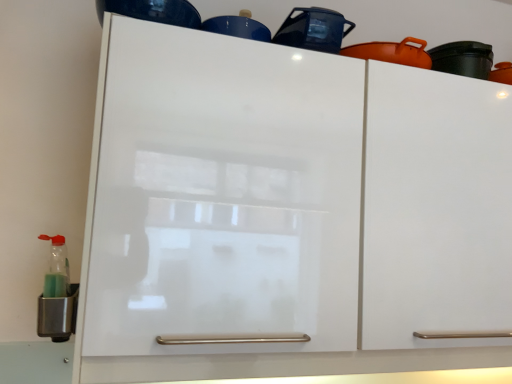
In order to face glossy ceramic pot at upper center, which ranks as the 2th appliance in bottom-to-top order, should I rotate leftwards or rightwards?

Turn right by 8.544 degrees to look at glossy ceramic pot at upper center, which ranks as the 2th appliance in bottom-to-top order.

What do you see at coordinates (58, 315) in the screenshot? I see `metallic green bottle at lower left, placed as the 1th appliance when sorted from bottom to top` at bounding box center [58, 315].

The image size is (512, 384). Find the location of `glossy blue cup at upper center, acting as the first appliance starting from the top`. glossy blue cup at upper center, acting as the first appliance starting from the top is located at coordinates (238, 26).

From the image's perspective, which object appears higher, glossy ceramic pot at upper center, the 3th appliance in the left-to-right sequence, or glossy blue cup at upper center, the third appliance in the bottom-to-top sequence?

glossy blue cup at upper center, the third appliance in the bottom-to-top sequence, appears higher in the image.

The width and height of the screenshot is (512, 384). In order to click on appliance that is above the glossy blue cup at upper center, acting as the first appliance starting from the top (from a real-world perspective) in this screenshot , I will do `click(314, 29)`.

From a real-world perspective, does glossy ceramic pot at upper center, the 3th appliance in the left-to-right sequence, sit lower than glossy blue cup at upper center, acting as the first appliance starting from the top?

Incorrect, from a real-world perspective, glossy ceramic pot at upper center, the 3th appliance in the left-to-right sequence, is higher than glossy blue cup at upper center, acting as the first appliance starting from the top.

Which of these two, glossy ceramic pot at upper center, which ranks as the 2th appliance in bottom-to-top order, or glossy blue cup at upper center, the second appliance from the left, is wider?

With larger width is glossy ceramic pot at upper center, which ranks as the 2th appliance in bottom-to-top order.

In the scene shown: How different are the orientations of glossy blue cup at upper center, the third appliance in the bottom-to-top sequence, and metallic green bottle at lower left, the 3th appliance in the right-to-left sequence, in degrees?

The facing directions of glossy blue cup at upper center, the third appliance in the bottom-to-top sequence, and metallic green bottle at lower left, the 3th appliance in the right-to-left sequence, are 81.4 degrees apart.

Can you confirm if glossy blue cup at upper center, the third appliance in the bottom-to-top sequence, is wider than metallic green bottle at lower left, the 3th appliance in the right-to-left sequence?

No.

Between point (255, 27) and point (56, 340), which one is positioned in front?

The point (255, 27) is closer to the camera.

Looking at the image, does glossy blue cup at upper center, the 2th appliance viewed from the right, seem bigger or smaller compared to metallic green bottle at lower left, placed as the 1th appliance when sorted from bottom to top?

Clearly, glossy blue cup at upper center, the 2th appliance viewed from the right, is smaller in size than metallic green bottle at lower left, placed as the 1th appliance when sorted from bottom to top.

In terms of size, does glossy blue cup at upper center, acting as the first appliance starting from the top, appear bigger or smaller than glossy ceramic pot at upper center, the 3th appliance in the left-to-right sequence?

Considering their sizes, glossy blue cup at upper center, acting as the first appliance starting from the top, takes up less space than glossy ceramic pot at upper center, the 3th appliance in the left-to-right sequence.

Is glossy blue cup at upper center, the third appliance in the bottom-to-top sequence, facing towards glossy ceramic pot at upper center, the 3th appliance in the left-to-right sequence?

No, glossy blue cup at upper center, the third appliance in the bottom-to-top sequence, is not turned towards glossy ceramic pot at upper center, the 3th appliance in the left-to-right sequence.

From the image's perspective, is glossy blue cup at upper center, the 2th appliance viewed from the right, above or below glossy ceramic pot at upper center, which ranks as the 2th appliance in bottom-to-top order?

glossy blue cup at upper center, the 2th appliance viewed from the right, is situated higher than glossy ceramic pot at upper center, which ranks as the 2th appliance in bottom-to-top order, in the image.

From a real-world perspective, which object rests below the other?

From a 3D spatial view, metallic green bottle at lower left, the 3th appliance when ordered from top to bottom, is below.

Is glossy ceramic pot at upper center, the 3th appliance in the left-to-right sequence, surrounding metallic green bottle at lower left, placed as the 1th appliance when sorted from bottom to top?

No, metallic green bottle at lower left, placed as the 1th appliance when sorted from bottom to top, is located outside of glossy ceramic pot at upper center, the 3th appliance in the left-to-right sequence.

Is glossy ceramic pot at upper center, the 3th appliance in the left-to-right sequence, to the left of metallic green bottle at lower left, placed as the 1th appliance when sorted from bottom to top, from the viewer's perspective?

In fact, glossy ceramic pot at upper center, the 3th appliance in the left-to-right sequence, is to the right of metallic green bottle at lower left, placed as the 1th appliance when sorted from bottom to top.

Which of these two, glossy ceramic pot at upper center, which ranks as the second appliance in top-to-bottom order, or metallic green bottle at lower left, placed as the 1th appliance when sorted from left to right, is wider?

glossy ceramic pot at upper center, which ranks as the second appliance in top-to-bottom order.

Would you say metallic green bottle at lower left, placed as the 1th appliance when sorted from left to right, is outside glossy blue cup at upper center, acting as the first appliance starting from the top?

Absolutely, metallic green bottle at lower left, placed as the 1th appliance when sorted from left to right, is external to glossy blue cup at upper center, acting as the first appliance starting from the top.

Does metallic green bottle at lower left, placed as the 1th appliance when sorted from bottom to top, have a lesser width compared to glossy blue cup at upper center, the 2th appliance viewed from the right?

Incorrect, the width of metallic green bottle at lower left, placed as the 1th appliance when sorted from bottom to top, is not less than that of glossy blue cup at upper center, the 2th appliance viewed from the right.

Does point (61, 330) lie behind point (232, 31)?

No, (61, 330) is in front of (232, 31).

Based on the photo, is metallic green bottle at lower left, the 3th appliance in the right-to-left sequence, bigger or smaller than glossy ceramic pot at upper center, which ranks as the second appliance in top-to-bottom order?

In the image, metallic green bottle at lower left, the 3th appliance in the right-to-left sequence, appears to be smaller than glossy ceramic pot at upper center, which ranks as the second appliance in top-to-bottom order.

Based on the photo, can you confirm if metallic green bottle at lower left, placed as the 1th appliance when sorted from left to right, is wider than glossy ceramic pot at upper center, acting as the first appliance starting from the right?

No, metallic green bottle at lower left, placed as the 1th appliance when sorted from left to right, is not wider than glossy ceramic pot at upper center, acting as the first appliance starting from the right.

Could you tell me if metallic green bottle at lower left, placed as the 1th appliance when sorted from left to right, is facing glossy ceramic pot at upper center, which ranks as the 2th appliance in bottom-to-top order?

No, metallic green bottle at lower left, placed as the 1th appliance when sorted from left to right, is not oriented towards glossy ceramic pot at upper center, which ranks as the 2th appliance in bottom-to-top order.

Based on their positions, is metallic green bottle at lower left, the 3th appliance in the right-to-left sequence, located to the left or right of glossy ceramic pot at upper center, the 3th appliance in the left-to-right sequence?

metallic green bottle at lower left, the 3th appliance in the right-to-left sequence, is to the left of glossy ceramic pot at upper center, the 3th appliance in the left-to-right sequence.

There is a glossy blue cup at upper center, the second appliance from the left. Identify the location of appliance above it (from a real-world perspective). The width and height of the screenshot is (512, 384). (314, 29).

I want to click on the 2nd appliance in front of the glossy blue cup at upper center, the second appliance from the left, so click(x=58, y=315).

Looking at the image, which one is located further to glossy ceramic pot at upper center, which ranks as the 2th appliance in bottom-to-top order, glossy blue cup at upper center, the 2th appliance viewed from the right, or metallic green bottle at lower left, the 3th appliance when ordered from top to bottom?

metallic green bottle at lower left, the 3th appliance when ordered from top to bottom, lies further to glossy ceramic pot at upper center, which ranks as the 2th appliance in bottom-to-top order, than the other object.

When comparing their distances from glossy blue cup at upper center, the third appliance in the bottom-to-top sequence, does metallic green bottle at lower left, the 3th appliance when ordered from top to bottom, or glossy ceramic pot at upper center, acting as the first appliance starting from the right, seem closer?

glossy ceramic pot at upper center, acting as the first appliance starting from the right, lies closer to glossy blue cup at upper center, the third appliance in the bottom-to-top sequence, than the other object.

Looking at the image, which one is located further to glossy blue cup at upper center, acting as the first appliance starting from the top, glossy ceramic pot at upper center, which ranks as the second appliance in top-to-bottom order, or metallic green bottle at lower left, placed as the 1th appliance when sorted from bottom to top?

metallic green bottle at lower left, placed as the 1th appliance when sorted from bottom to top.

Based on their spatial positions, is glossy ceramic pot at upper center, which ranks as the second appliance in top-to-bottom order, or glossy blue cup at upper center, the 2th appliance viewed from the right, closer to metallic green bottle at lower left, the 3th appliance in the right-to-left sequence?

glossy blue cup at upper center, the 2th appliance viewed from the right, is positioned closer to the anchor metallic green bottle at lower left, the 3th appliance in the right-to-left sequence.

Based on their spatial positions, is glossy blue cup at upper center, the second appliance from the left, or glossy ceramic pot at upper center, acting as the first appliance starting from the right, further from metallic green bottle at lower left, the 3th appliance in the right-to-left sequence?

glossy ceramic pot at upper center, acting as the first appliance starting from the right, lies further to metallic green bottle at lower left, the 3th appliance in the right-to-left sequence, than the other object.

Which object lies further to the anchor point glossy ceramic pot at upper center, the 3th appliance in the left-to-right sequence, metallic green bottle at lower left, placed as the 1th appliance when sorted from bottom to top, or glossy blue cup at upper center, the 2th appliance viewed from the right?

Among the two, metallic green bottle at lower left, placed as the 1th appliance when sorted from bottom to top, is located further to glossy ceramic pot at upper center, the 3th appliance in the left-to-right sequence.

The height and width of the screenshot is (384, 512). What are the coordinates of `appliance that lies between glossy blue cup at upper center, the third appliance in the bottom-to-top sequence, and metallic green bottle at lower left, the 3th appliance when ordered from top to bottom, from top to bottom` in the screenshot? It's located at (314, 29).